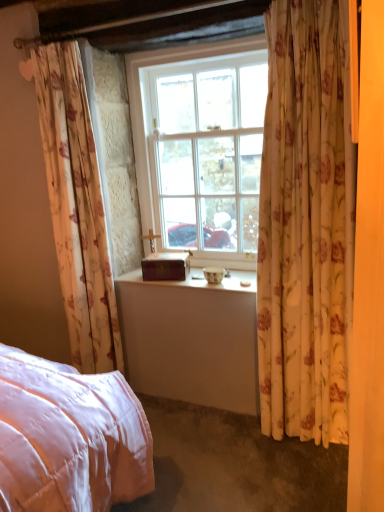
Question: From the image's perspective, relative to white glass window at center, is wooden box at center above or below?

Choices:
 (A) below
 (B) above

Answer: (A)

Question: In the image, is wooden box at center on the left side or the right side of white glass window at center?

Choices:
 (A) right
 (B) left

Answer: (B)

Question: Which object is positioned closest to the floral fabric curtain at right, the 1th curtain from the right?

Choices:
 (A) white glass window at center
 (B) wooden box at center
 (C) floral fabric curtain at left, marked as the first curtain in a left-to-right arrangement
 (D) wooden box at center

Answer: (B)

Question: Estimate the real-world distances between objects in this image. Which object is closer to the floral fabric curtain at right, marked as the 2th curtain in a left-to-right arrangement?

Choices:
 (A) wooden box at center
 (B) white glass window at center
 (C) floral fabric curtain at left, marked as the first curtain in a left-to-right arrangement
 (D) wooden box at center

Answer: (A)